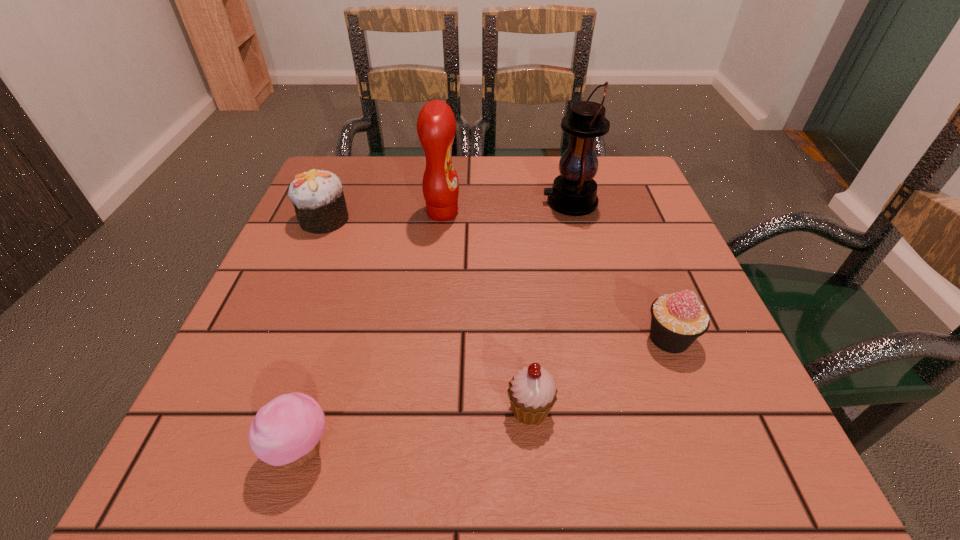
This screenshot has width=960, height=540. In order to click on free location located 0.280m on the front of the farthest cupcake in this screenshot , I will do `click(275, 339)`.

Locate an element on the screen. The height and width of the screenshot is (540, 960). free space located on the left of the rightmost cupcake is located at coordinates (547, 338).

In order to click on vacant point located 0.080m on the back of the third object from right to left in this screenshot , I will do `click(524, 346)`.

This screenshot has height=540, width=960. In order to click on lantern that is at the far edge in this screenshot , I will do `click(574, 192)`.

At what (x,y) coordinates should I click in order to perform the action: click on condiment present at the far edge. Please return your answer as a coordinate pair (x, y). Image resolution: width=960 pixels, height=540 pixels. Looking at the image, I should click on (436, 125).

The image size is (960, 540). Find the location of `cupcake that is at the far edge`. cupcake that is at the far edge is located at coordinates (317, 195).

Find the location of a particular element. Image resolution: width=960 pixels, height=540 pixels. lantern that is at the right edge is located at coordinates (574, 192).

Locate an element on the screen. cupcake that is positioned at the right edge is located at coordinates (677, 320).

This screenshot has height=540, width=960. I want to click on object situated at the far left corner, so click(317, 195).

At what (x,y) coordinates should I click in order to perform the action: click on object that is at the near left corner. Please return your answer as a coordinate pair (x, y). This screenshot has width=960, height=540. Looking at the image, I should click on (286, 431).